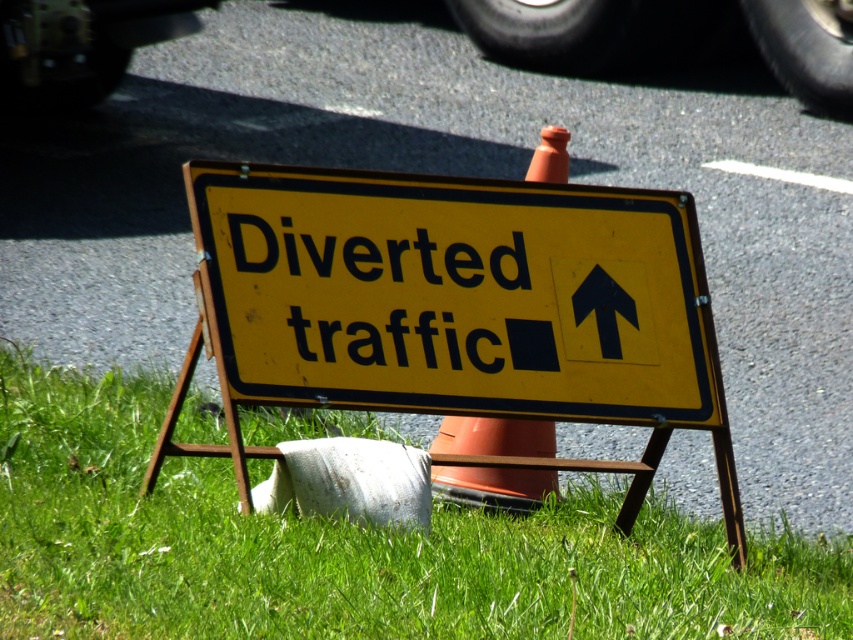
Is green grass at lower left above black rubber tire at upper center?

No, green grass at lower left is not above black rubber tire at upper center.

Between green grass at lower left and black rubber tire at upper center, which one has more height?

Standing taller between the two is green grass at lower left.

In order to click on green grass at lower left in this screenshot , I will do `click(349, 548)`.

The image size is (853, 640). Identify the location of green grass at lower left. (349, 548).

Does yellow matte sign at center appear on the left side of black rubber tire at upper center?

Correct, you'll find yellow matte sign at center to the left of black rubber tire at upper center.

Is yellow matte sign at center positioned at the back of black rubber tire at upper center?

No, yellow matte sign at center is in front of black rubber tire at upper center.

Between point (556, 364) and point (653, 51), which one is positioned in front?

Positioned in front is point (556, 364).

At what (x,y) coordinates should I click in order to perform the action: click on yellow matte sign at center. Please return your answer as a coordinate pair (x, y). The height and width of the screenshot is (640, 853). Looking at the image, I should click on (454, 308).

Who is higher up, black rubber tire at upper center or orange plastic traffic cone at center?

black rubber tire at upper center

Between black rubber tire at upper center and orange plastic traffic cone at center, which one is positioned lower?

orange plastic traffic cone at center

What are the coordinates of `black rubber tire at upper center` in the screenshot? It's located at (669, 36).